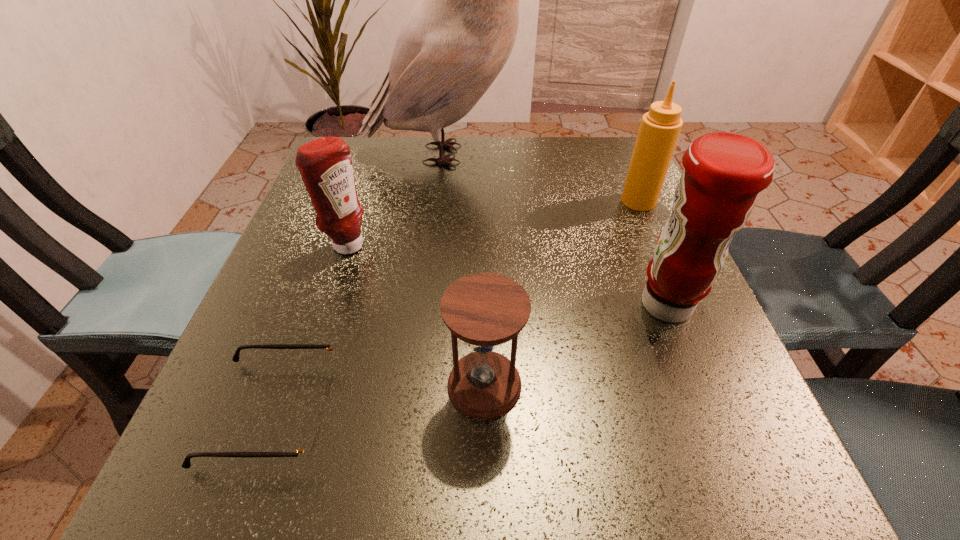
Locate an element on the screen. The image size is (960, 540). object positioned at the near left corner is located at coordinates (308, 446).

In the image, there is a desktop. Identify the location of vacant space at the far edge. Image resolution: width=960 pixels, height=540 pixels. (408, 175).

What are the coordinates of `free space at the left edge of the desktop` in the screenshot? It's located at (288, 279).

Find the location of a particular element. The width and height of the screenshot is (960, 540). blank space at the right edge is located at coordinates (744, 383).

At what (x,y) coordinates should I click in order to perform the action: click on vacant space that's between the fifth tallest object and the third farthest object. Please return your answer as a coordinate pair (x, y). Looking at the image, I should click on (416, 315).

This screenshot has width=960, height=540. I want to click on empty space between the tallest object and the hourglass, so click(467, 269).

Image resolution: width=960 pixels, height=540 pixels. I want to click on free space between the hourglass and the shortest object, so click(379, 399).

Where is `vacant space that is in between the fifth nearest object and the shortest condiment`? This screenshot has width=960, height=540. vacant space that is in between the fifth nearest object and the shortest condiment is located at coordinates (492, 223).

Locate an element on the screen. This screenshot has width=960, height=540. free spot between the hourglass and the farthest condiment is located at coordinates (562, 293).

At what (x,y) coordinates should I click in order to perform the action: click on free space between the third nearest object and the third farthest object. Please return your answer as a coordinate pair (x, y). Image resolution: width=960 pixels, height=540 pixels. Looking at the image, I should click on (506, 275).